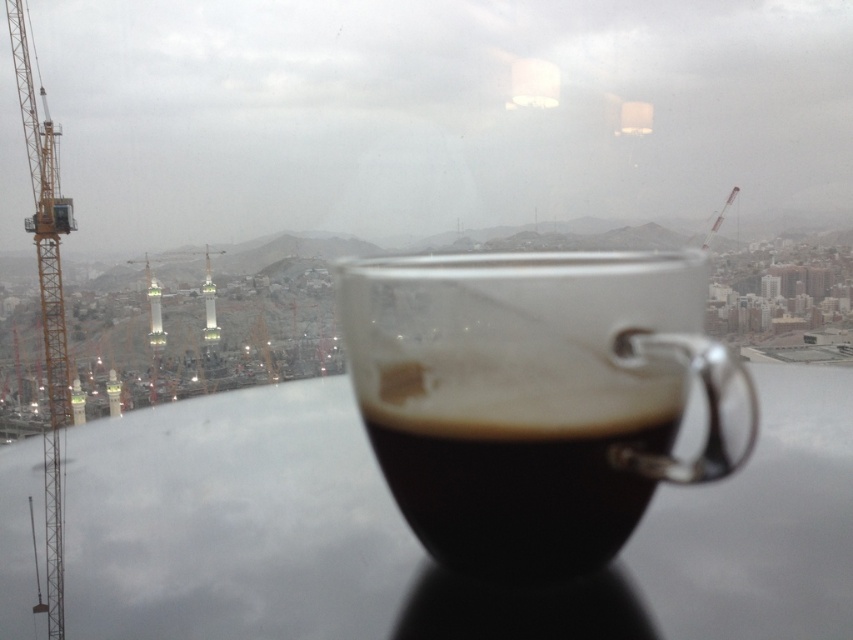
You are standing in front of a window looking at a cup of coffee and the city outside. There are two points marked on the window. One is at coordinates point (456,461) and the other is at point (73,225). Which point is nearer to you?

Point (456,461) is closer to the viewer than point (73,225).

You are an architect reviewing a city model through a window. You see the black matte cup at center and the yellow metallic crane at left. Which object is nearer to your eyes?

The black matte cup at center is closer to the viewer than the yellow metallic crane at left, so the black matte cup at center is nearer to your eyes.

You are a delivery robot with a 6.5 inch wide package. You need to place the package on the table between the black matte cup at center and the yellow metallic crane at left. Can you fit the package in the space between them?

The distance between the black matte cup at center and the yellow metallic crane at left is 6.57 inches. Since the package is 6.5 inches wide, it should fit with a small amount of space remaining.